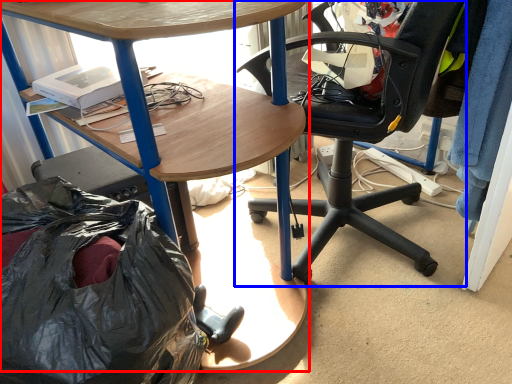
Question: Which object appears closest to the camera in this image, desk (highlighted by a red box) or chair (highlighted by a blue box)?

Choices:
 (A) desk
 (B) chair

Answer: (A)